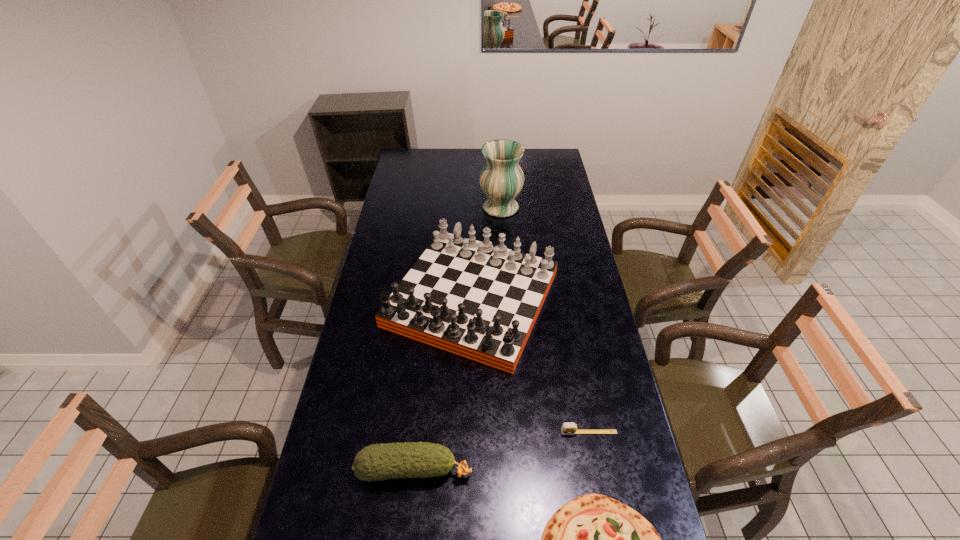
At what (x,y) coordinates should I click in order to perform the action: click on free space between the fourth tallest object and the third tallest object. Please return your answer as a coordinate pair (x, y). Looking at the image, I should click on (502, 451).

Where is `free spot between the third nearest object and the gameboard`? Image resolution: width=960 pixels, height=540 pixels. free spot between the third nearest object and the gameboard is located at coordinates (530, 366).

This screenshot has width=960, height=540. I want to click on unoccupied area between the third nearest object and the second tallest object, so click(x=530, y=366).

Find the location of `empty location between the third farthest object and the gameboard`. empty location between the third farthest object and the gameboard is located at coordinates (530, 366).

Locate an element on the screen. The image size is (960, 540). object that is the fourth closest to the second farthest object is located at coordinates (593, 539).

Identify which object is located as the third nearest to the fourth farthest object. Please provide its 2D coordinates. Your answer should be formatted as a tuple, i.e. [(x, y)], where the tuple contains the x and y coordinates of a point satisfying the conditions above.

[(570, 428)]

Image resolution: width=960 pixels, height=540 pixels. What are the coordinates of `free location that satisfies the following two spatial constraints: 1. on the front side of the gameboard; 2. at the blossom end of the cucumber` in the screenshot? It's located at (469, 469).

Where is `vacant space that satisfies the following two spatial constraints: 1. at the front of the tape measure with the tape extended; 2. at the blossom end of the cucumber`? vacant space that satisfies the following two spatial constraints: 1. at the front of the tape measure with the tape extended; 2. at the blossom end of the cucumber is located at coordinates (596, 469).

Identify the location of blank space that satisfies the following two spatial constraints: 1. at the front of the second shortest object with the tape extended; 2. at the blossom end of the cucumber. (596, 469).